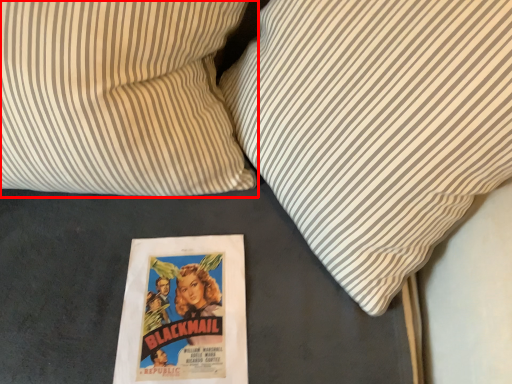
Question: From the image's perspective, where is pillow (annotated by the red box) located in relation to pillow in the image?

Choices:
 (A) above
 (B) below

Answer: (A)